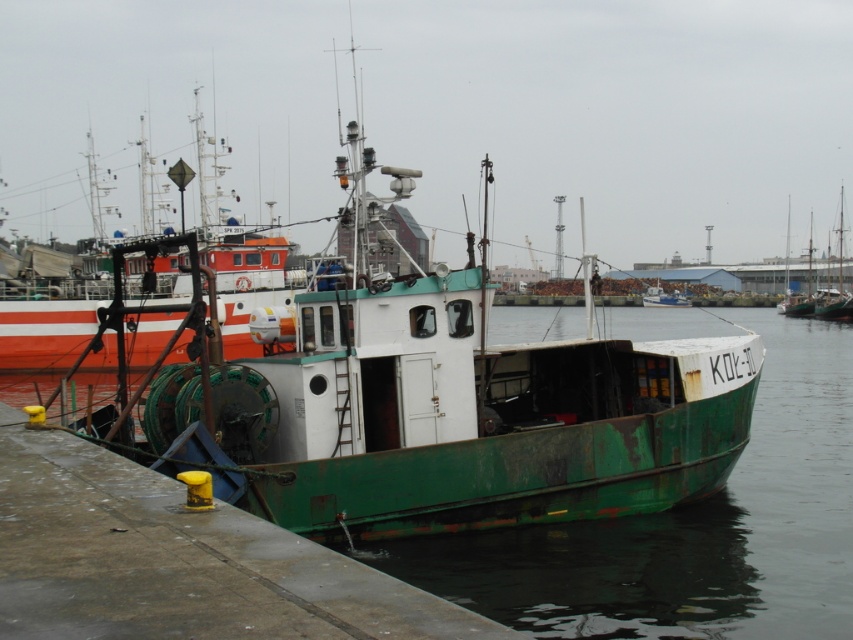
Which of these two, green rusty water at lower center or green rusty boat at center, stands taller?

With more height is green rusty water at lower center.

Looking at this image, which is more to the right, green rusty water at lower center or green rusty boat at center?

green rusty boat at center

The width and height of the screenshot is (853, 640). I want to click on green rusty water at lower center, so click(x=689, y=529).

Can you confirm if green rusty water at lower center is taller than concrete dock at lower left?

Yes.

Is green rusty water at lower center thinner than concrete dock at lower left?

In fact, green rusty water at lower center might be wider than concrete dock at lower left.

Where is `green rusty water at lower center`? green rusty water at lower center is located at coordinates [689, 529].

Measure the distance between concrete dock at lower left and camera.

concrete dock at lower left and camera are 31.35 feet apart from each other.

Who is positioned more to the left, concrete dock at lower left or green rusty boat at center?

Positioned to the left is concrete dock at lower left.

Is point (334, 634) less distant than point (674, 294)?

That is True.

I want to click on concrete dock at lower left, so click(177, 561).